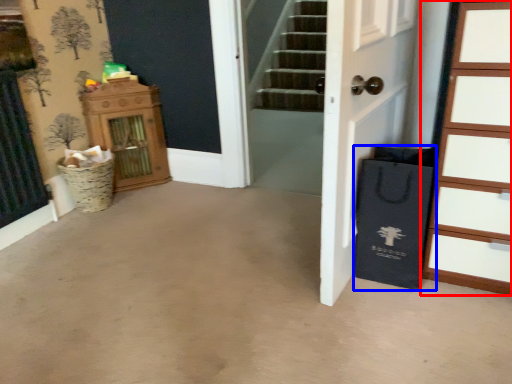
Question: Among these objects, which one is farthest to the camera, chest of drawers (highlighted by a red box) or shopping bag (highlighted by a blue box)?

Choices:
 (A) chest of drawers
 (B) shopping bag

Answer: (B)